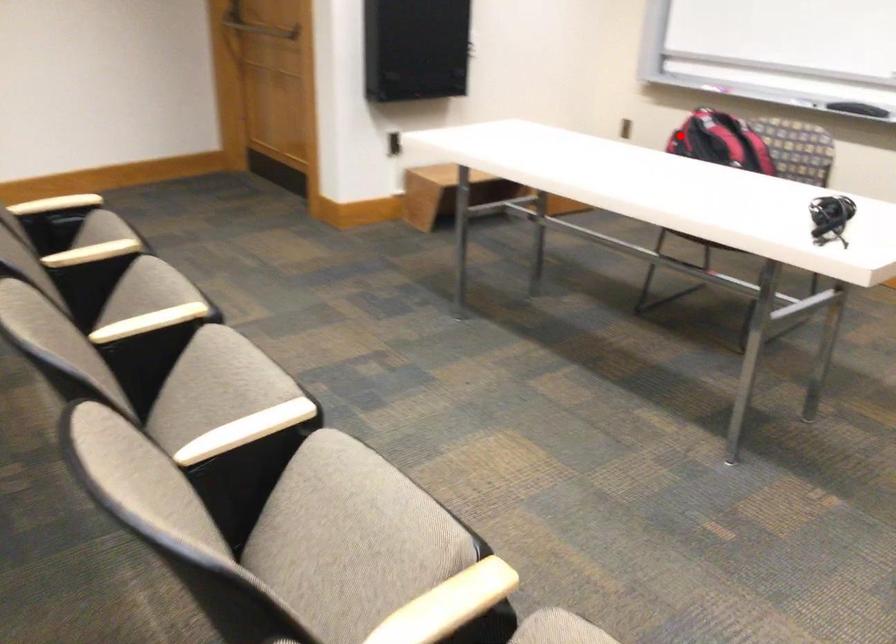
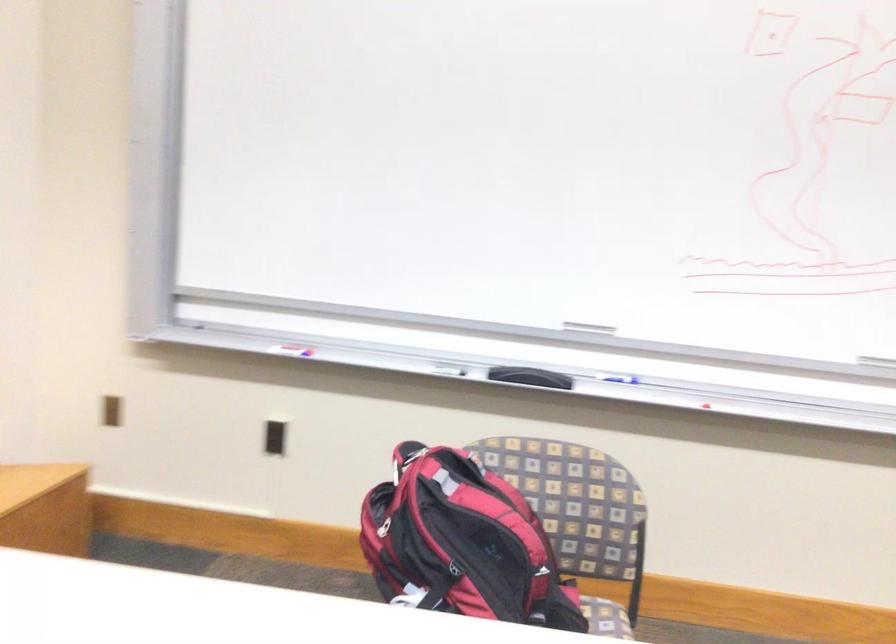
Locate, in the second image, the point that corresponds to the highlighted location in the first image.

(383, 527)